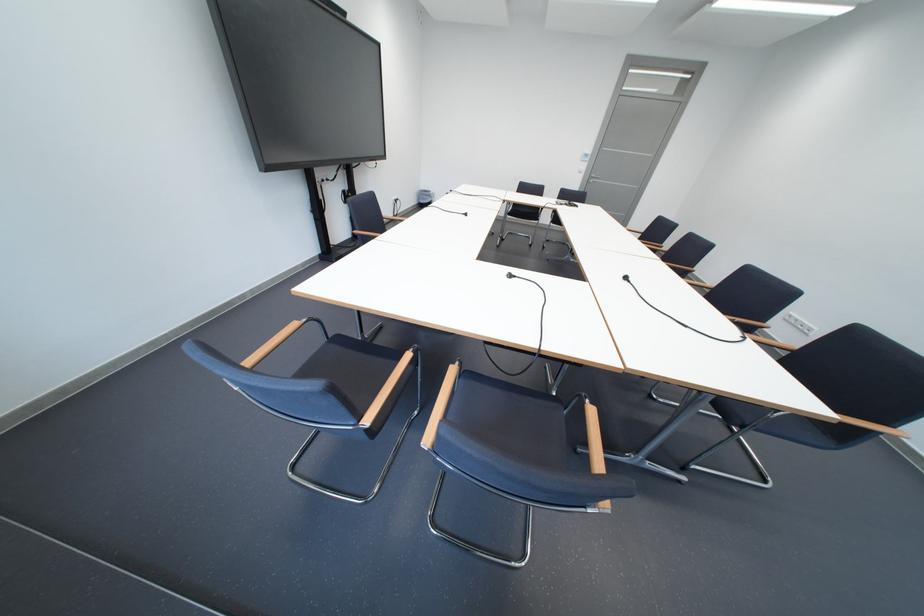
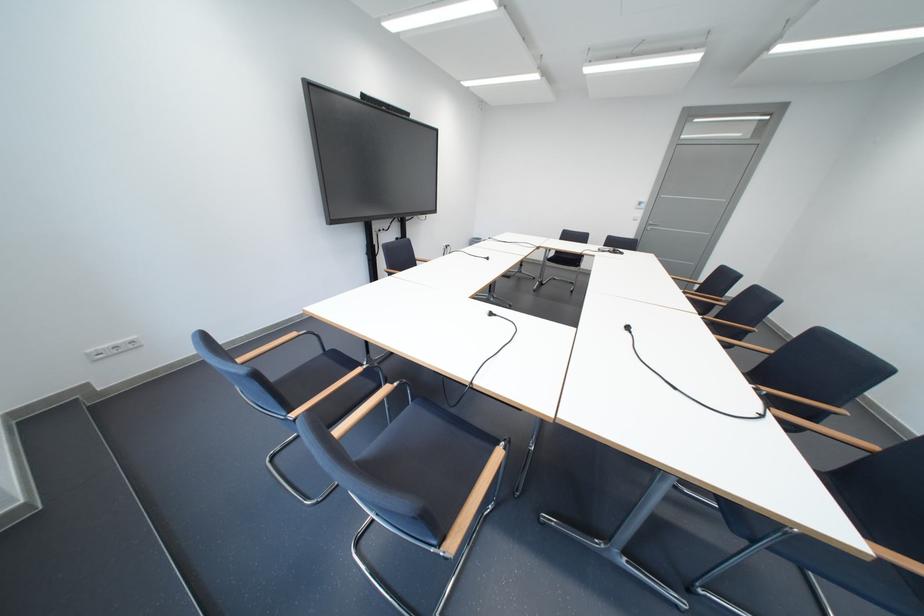
Question: The images are taken continuously from a first-person perspective. In which direction is your viewpoint rotating?

Choices:
 (A) Left
 (B) Right
 (C) Up
 (D) Down

Answer: (A)